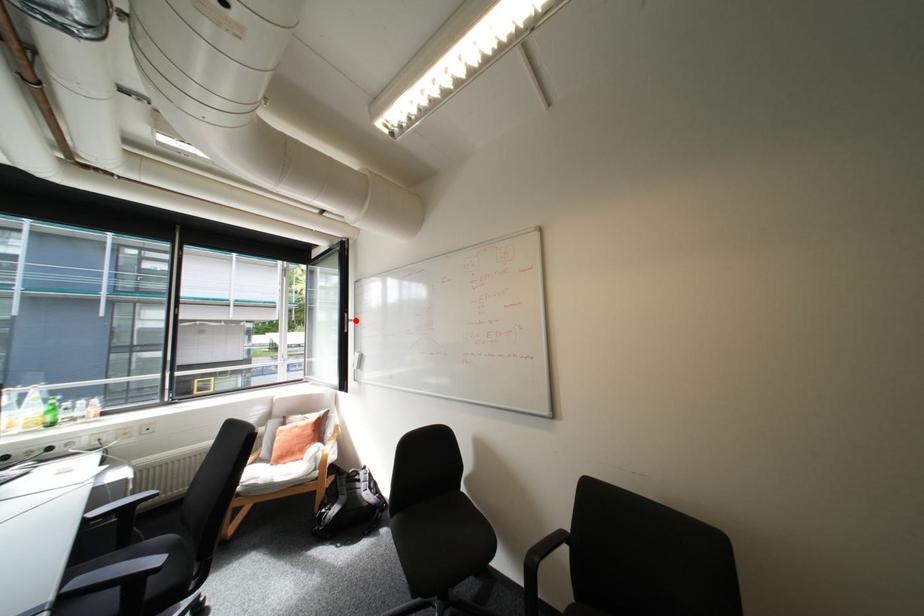
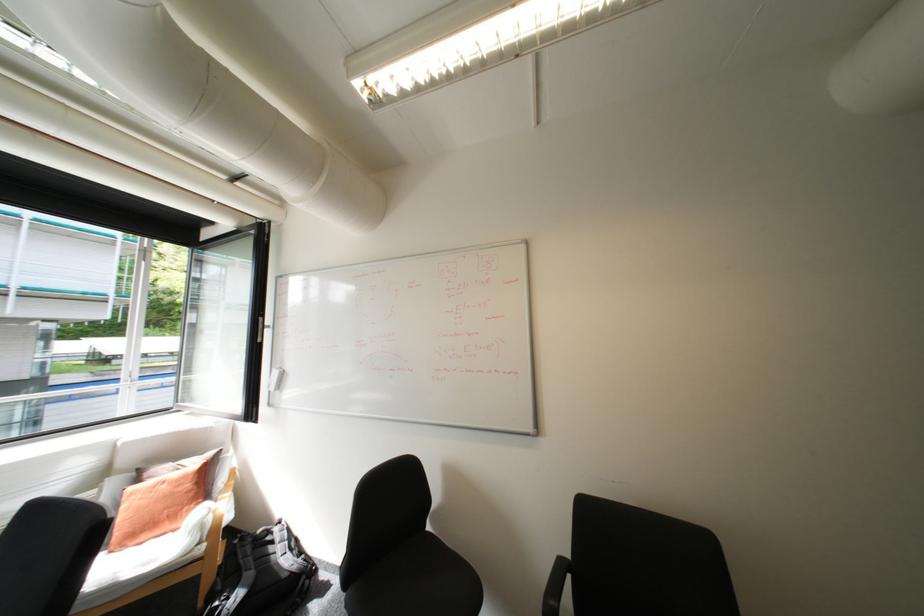
Question: I am providing you with two images of the same scene from different viewpoints. Image1 has a red point marked. In image2, the corresponding 3D location appears at what relative position? Reply with the corresponding letter.

Choices:
 (A) Closer
 (B) Farther

Answer: (B)